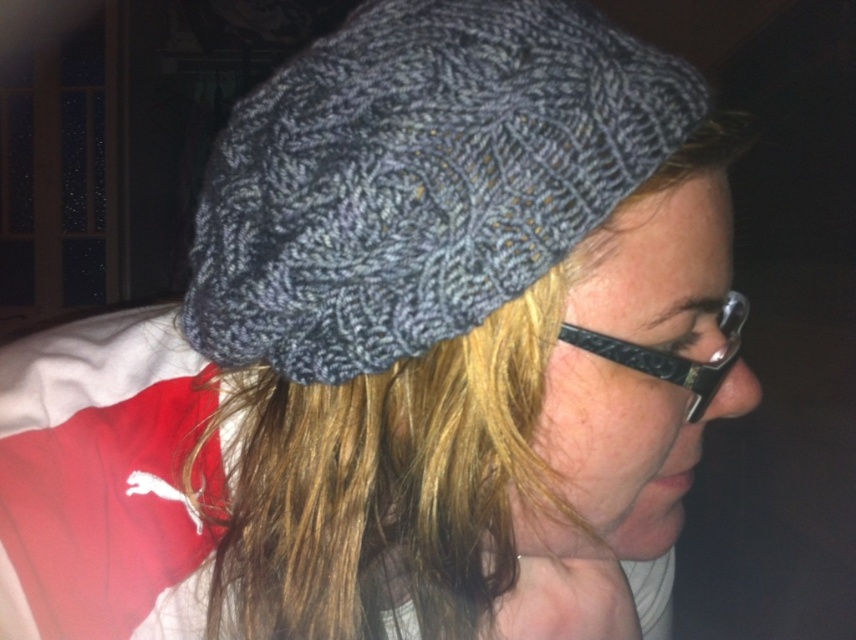
Which is in front, point (491, 182) or point (724, 300)?

Point (491, 182) is more forward.

Who is more forward, (522, 218) or (746, 300)?

Point (522, 218)

Identify the location of knitted gray hat at upper center. The image size is (856, 640). (419, 179).